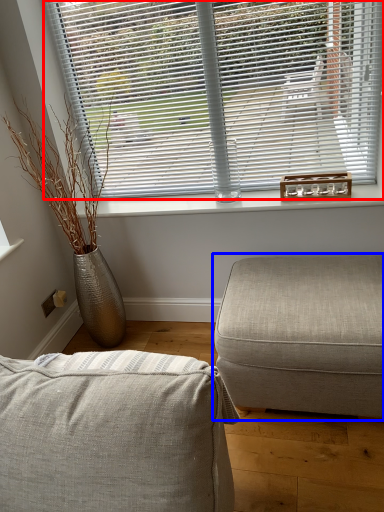
Question: Among these objects, which one is farthest to the camera, window blind (highlighted by a red box) or studio couch (highlighted by a blue box)?

Choices:
 (A) window blind
 (B) studio couch

Answer: (A)